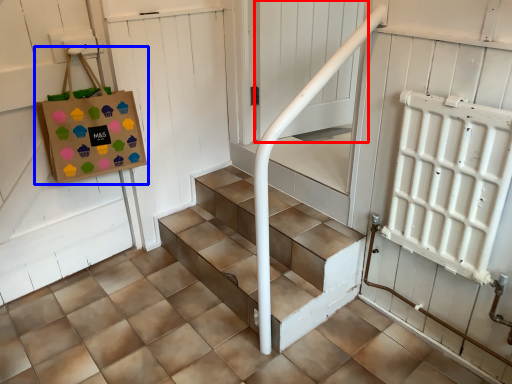
Question: Which of the following is the closest to the observer, screen door (highlighted by a red box) or bag (highlighted by a blue box)?

Choices:
 (A) screen door
 (B) bag

Answer: (B)